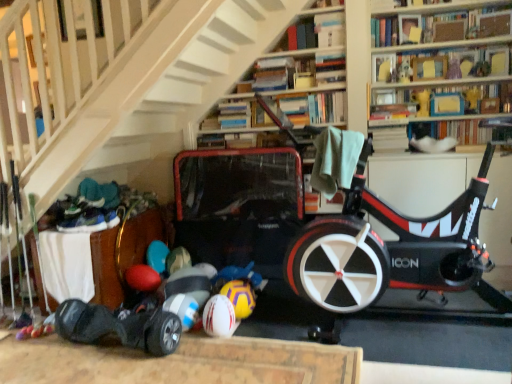
Question: Is hardcover book at upper center, which is the second book in bottom-to-top order, situated inside hardcover book at upper center, the 1th book when ordered from top to bottom, or outside?

Choices:
 (A) outside
 (B) inside

Answer: (A)

Question: Looking at the image, does hardcover book at upper center, which is the second book in bottom-to-top order, seem bigger or smaller compared to hardcover book at upper center, the 1th book when ordered from top to bottom?

Choices:
 (A) big
 (B) small

Answer: (B)

Question: Which is farther from the hardcover book at upper center, the 1th book when ordered from top to bottom?

Choices:
 (A) yellowtexturebeach ball at lower center
 (B) wooden chest at lower left
 (C) blue cardboard book at upper right, which appears as the 4th book when viewed from the top
 (D) white matte rugby ball at lower center
 (E) hardcover book at upper right, the 6th book in the top-to-bottom sequence

Answer: (B)

Question: Which of these objects is positioned closest to the matte cardboard book at upper right, which is the 4th book from bottom to top?

Choices:
 (A) hardcover book at upper center, which is counted as the 5th book, starting from the top
 (B) hardcover book at upper center, the sixth book when ordered from bottom to top
 (C) hardcover book at upper right, the 6th book in the top-to-bottom sequence
 (D) yellowtexturebeach ball at lower center
 (E) white matte rugby ball at lower center

Answer: (B)